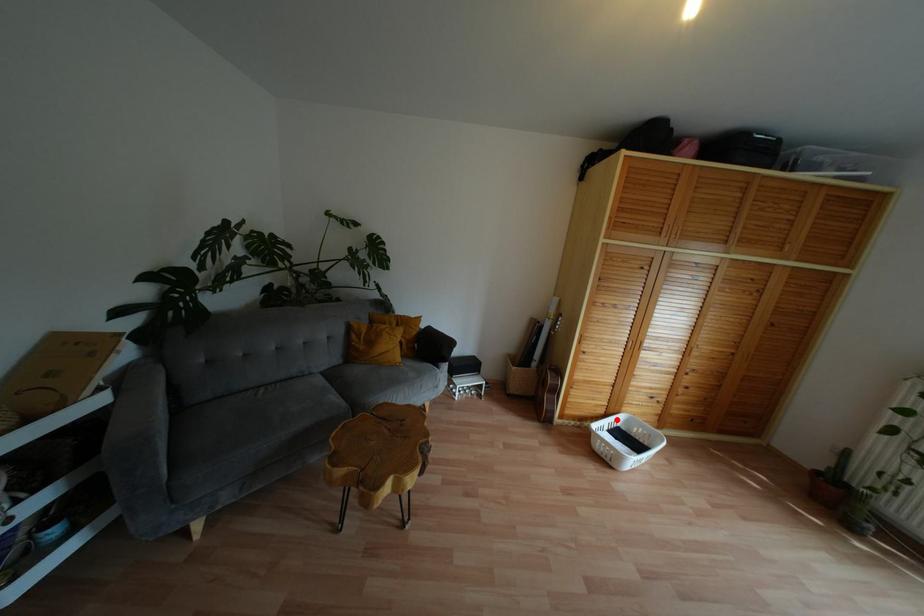
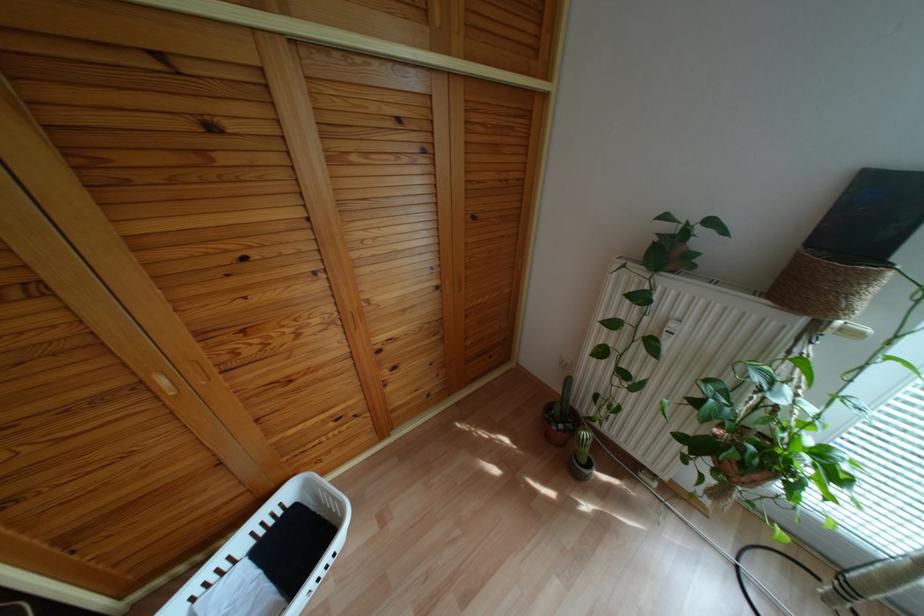
Find the pixel in the second image that matches the highlighted location in the first image.

(287, 493)